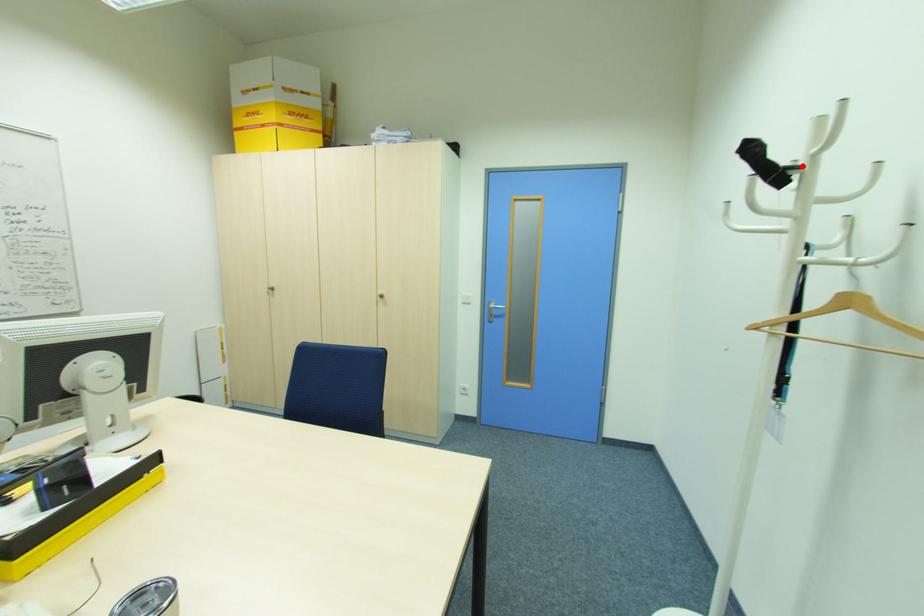
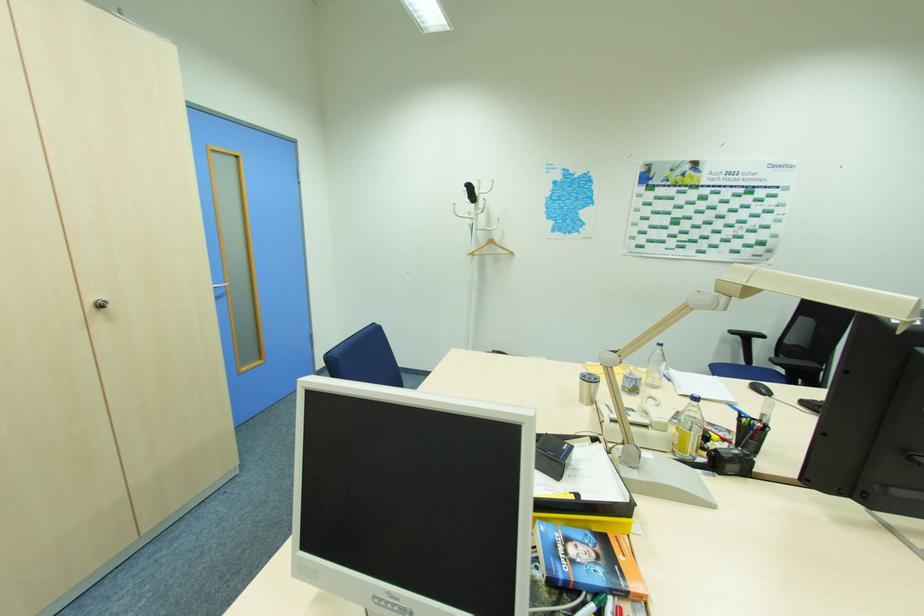
Question: I am providing you with two images of the same scene from different viewpoints. Given a red point in image1, look at the same physical point in image2. Is it:

Choices:
 (A) Closer to the viewpoint
 (B) Farther from the viewpoint

Answer: (A)